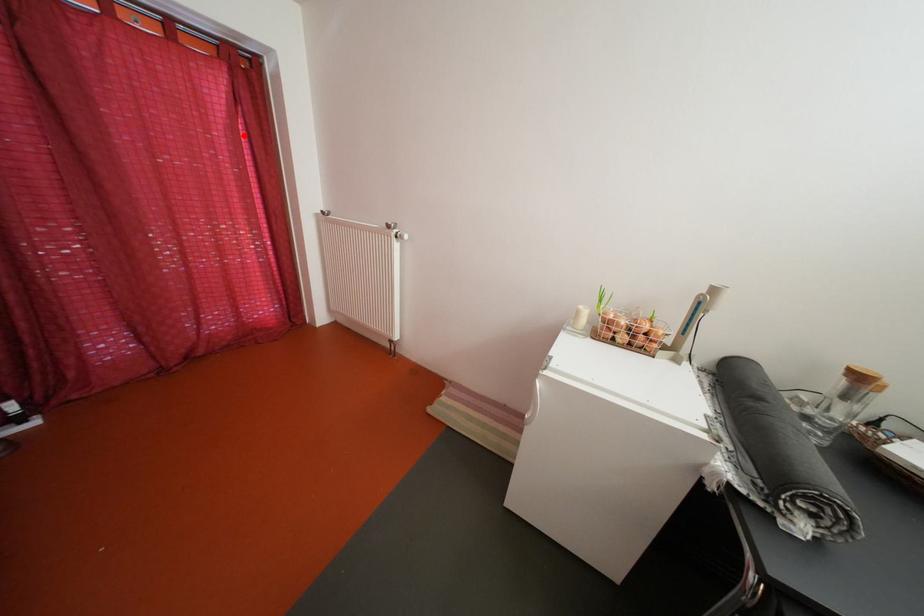
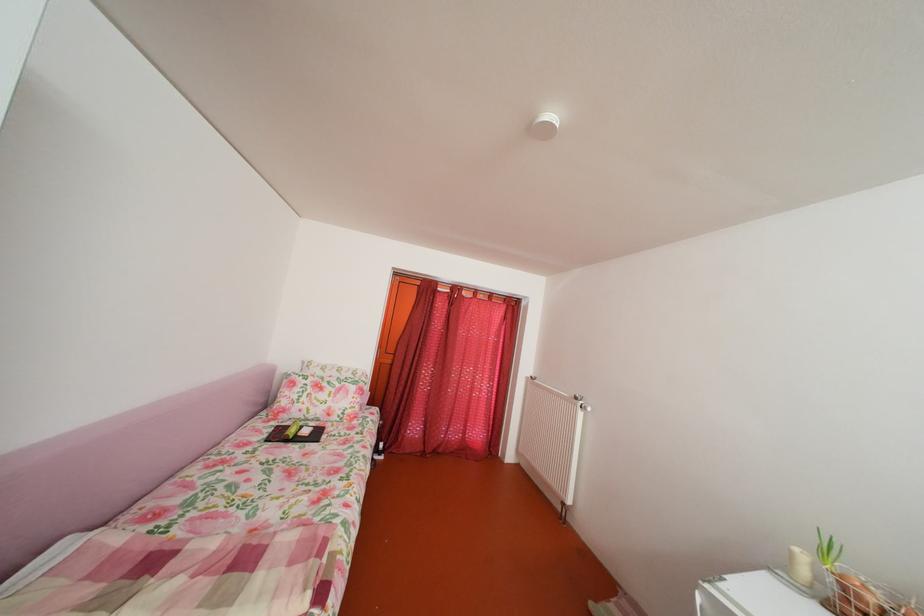
Question: I am providing you with two images of the same scene from different viewpoints. A red point is marked on the first image. Is the red point's position out of view in image 2?

Choices:
 (A) Yes
 (B) No

Answer: (B)